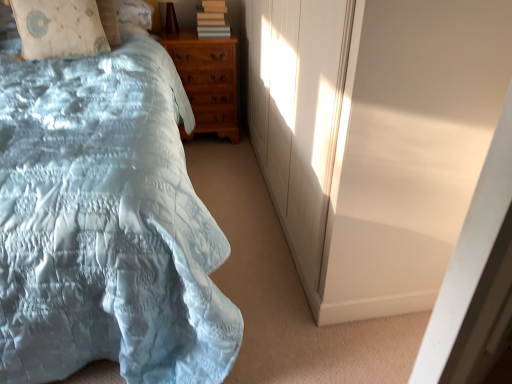
Question: Are beige fabric pillow at upper left and matte gray book at upper center beside each other?

Choices:
 (A) no
 (B) yes

Answer: (A)

Question: Is beige fabric pillow at upper left closer to the viewer compared to matte gray book at upper center?

Choices:
 (A) yes
 (B) no

Answer: (A)

Question: Does beige fabric pillow at upper left have a lesser height compared to matte gray book at upper center?

Choices:
 (A) no
 (B) yes

Answer: (A)

Question: Does beige fabric pillow at upper left have a greater height compared to matte gray book at upper center?

Choices:
 (A) yes
 (B) no

Answer: (A)

Question: Is matte gray book at upper center at the back of beige fabric pillow at upper left?

Choices:
 (A) yes
 (B) no

Answer: (B)

Question: Is beige fabric pillow at upper left aimed at matte gray book at upper center?

Choices:
 (A) no
 (B) yes

Answer: (A)

Question: From a real-world perspective, does matte brown table lamp at upper center sit lower than beige fabric pillow at upper left?

Choices:
 (A) yes
 (B) no

Answer: (B)

Question: From the image's perspective, is matte brown table lamp at upper center beneath beige fabric pillow at upper left?

Choices:
 (A) yes
 (B) no

Answer: (B)

Question: Is there a large distance between matte brown table lamp at upper center and beige fabric pillow at upper left?

Choices:
 (A) no
 (B) yes

Answer: (A)

Question: From a real-world perspective, is matte brown table lamp at upper center positioned over beige fabric pillow at upper left based on gravity?

Choices:
 (A) no
 (B) yes

Answer: (B)

Question: Is beige fabric pillow at upper left surrounded by matte brown table lamp at upper center?

Choices:
 (A) yes
 (B) no

Answer: (B)

Question: Does matte brown table lamp at upper center have a greater width compared to beige fabric pillow at upper left?

Choices:
 (A) yes
 (B) no

Answer: (B)

Question: Can you confirm if light blue satin bed at left is thinner than matte gray book at upper center?

Choices:
 (A) yes
 (B) no

Answer: (B)